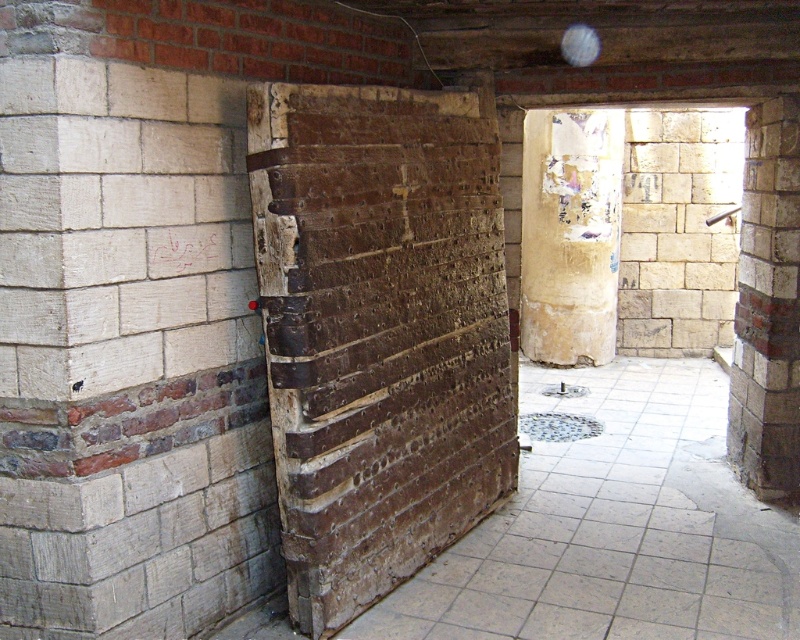
Based on the photo, can you confirm if stained concrete pillar at center is taller than white brick pillar at center?

Correct, stained concrete pillar at center is much taller as white brick pillar at center.

Does point (606, 262) come farther from viewer compared to point (762, 134)?

Yes, it is.

Find the location of a particular element. The width and height of the screenshot is (800, 640). stained concrete pillar at center is located at coordinates (570, 234).

Is light beige stone wall at right positioned in front of white brick pillar at center?

No, light beige stone wall at right is behind white brick pillar at center.

Does light beige stone wall at right have a larger size compared to white brick pillar at center?

Yes, light beige stone wall at right is bigger than white brick pillar at center.

Locate an element on the screen. The width and height of the screenshot is (800, 640). light beige stone wall at right is located at coordinates (678, 230).

The width and height of the screenshot is (800, 640). I want to click on light beige stone wall at right, so click(678, 230).

Is light beige stone wall at right bigger than stained concrete pillar at center?

Actually, light beige stone wall at right might be smaller than stained concrete pillar at center.

Which is behind, point (670, 339) or point (608, 296)?

Positioned behind is point (670, 339).

I want to click on light beige stone wall at right, so (x=678, y=230).